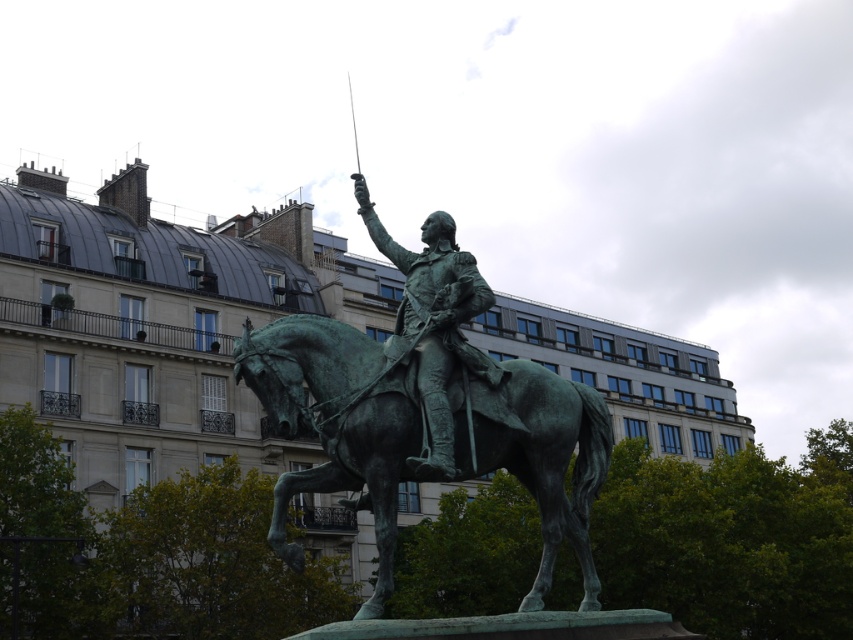
Question: Is green patina horse at center above green patina statue at center?

Choices:
 (A) yes
 (B) no

Answer: (B)

Question: Which point is farther to the camera?

Choices:
 (A) (434, 460)
 (B) (270, 394)

Answer: (B)

Question: Considering the relative positions of green patina horse at center and green patina statue at center in the image provided, where is green patina horse at center located with respect to green patina statue at center?

Choices:
 (A) right
 (B) left

Answer: (A)

Question: Is the position of green patina horse at center more distant than that of green patina statue at center?

Choices:
 (A) yes
 (B) no

Answer: (A)